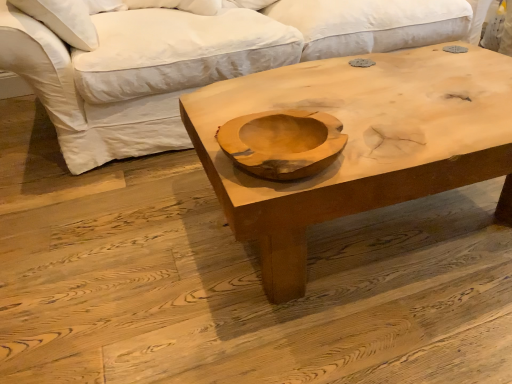
Question: Is natural wood coffee table at center in front of or behind white cotton studio couch at upper center in the image?

Choices:
 (A) behind
 (B) front

Answer: (B)

Question: Is natural wood coffee table at center bigger or smaller than white cotton studio couch at upper center?

Choices:
 (A) small
 (B) big

Answer: (A)

Question: Based on their positions, is natural wood coffee table at center located to the left or right of white cotton studio couch at upper center?

Choices:
 (A) left
 (B) right

Answer: (B)

Question: From their relative heights in the image, would you say white cotton studio couch at upper center is taller or shorter than natural wood coffee table at center?

Choices:
 (A) tall
 (B) short

Answer: (A)

Question: Is white cotton studio couch at upper center wider or thinner than natural wood coffee table at center?

Choices:
 (A) wide
 (B) thin

Answer: (A)

Question: Is white cotton studio couch at upper center in front of or behind natural wood coffee table at center in the image?

Choices:
 (A) front
 (B) behind

Answer: (B)

Question: From the image's perspective, is white cotton studio couch at upper center positioned above or below natural wood coffee table at center?

Choices:
 (A) above
 (B) below

Answer: (A)